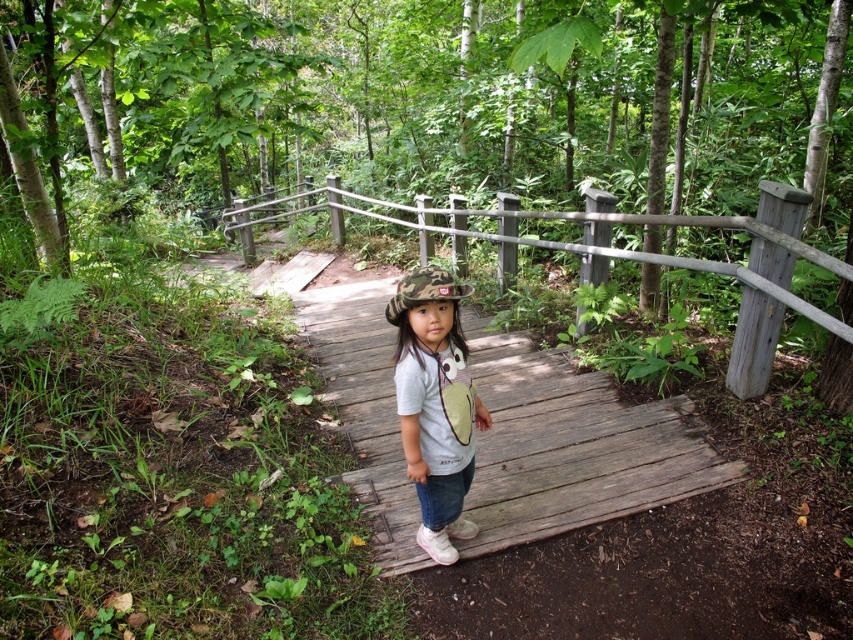
Question: Is camo fabric hat at center positioned at the back of camo fabric helmet at center?

Choices:
 (A) yes
 (B) no

Answer: (B)

Question: Based on their relative distances, which object is nearer to the camo fabric helmet at center?

Choices:
 (A) wooden at center
 (B) wooden rail at center

Answer: (A)

Question: Does wooden rail at center have a smaller size compared to camo fabric helmet at center?

Choices:
 (A) no
 (B) yes

Answer: (A)

Question: Is wooden rail at center bigger than camo fabric hat at center?

Choices:
 (A) no
 (B) yes

Answer: (B)

Question: Which of the following is the closest to the observer?

Choices:
 (A) camo fabric helmet at center
 (B) wooden at center

Answer: (A)

Question: Which of these objects is positioned closest to the wooden at center?

Choices:
 (A) camo fabric hat at center
 (B) wooden rail at center
 (C) camo fabric helmet at center

Answer: (A)